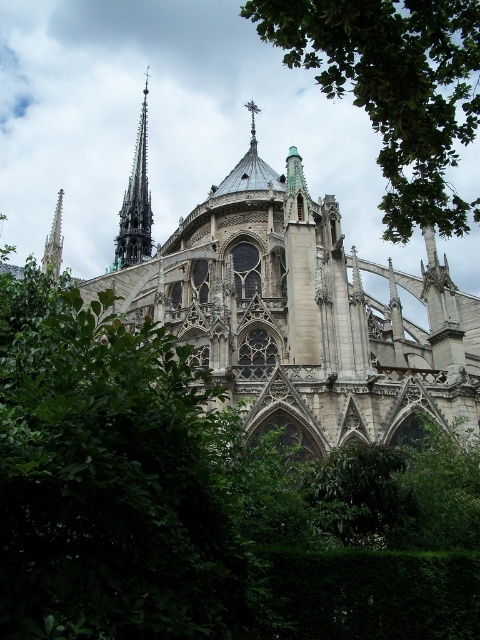
Who is more distant from viewer, (471, 308) or (143, 109)?

Positioned behind is point (143, 109).

What are the coordinates of `stone church at center` in the screenshot? It's located at (304, 316).

This screenshot has height=640, width=480. In order to click on stone church at center in this screenshot , I will do `click(304, 316)`.

Is dark gray stone spire at upper left to the right of smooth stone spire at left from the viewer's perspective?

Incorrect, dark gray stone spire at upper left is not on the right side of smooth stone spire at left.

From the picture: Does dark gray stone spire at upper left appear on the left side of smooth stone spire at left?

Correct, you'll find dark gray stone spire at upper left to the left of smooth stone spire at left.

Where is `dark gray stone spire at upper left`? This screenshot has height=640, width=480. dark gray stone spire at upper left is located at coordinates 135,204.

Between stone church at center and green leafy tree at upper center, which one has more height?

green leafy tree at upper center

Who is higher up, stone church at center or green leafy tree at upper center?

Positioned higher is green leafy tree at upper center.

Find the location of `stone church at center`. stone church at center is located at coordinates (304, 316).